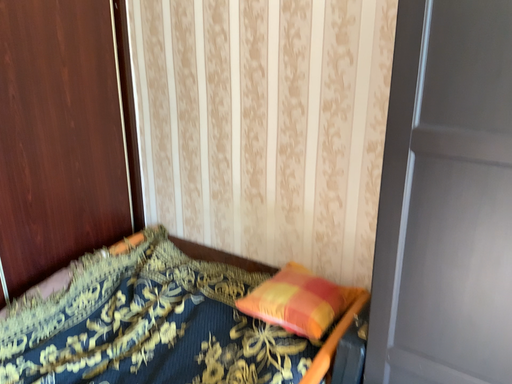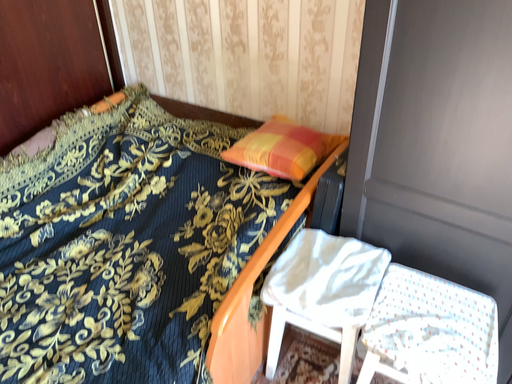
Question: Which way did the camera rotate in the video?

Choices:
 (A) rotated downward
 (B) rotated upward

Answer: (A)